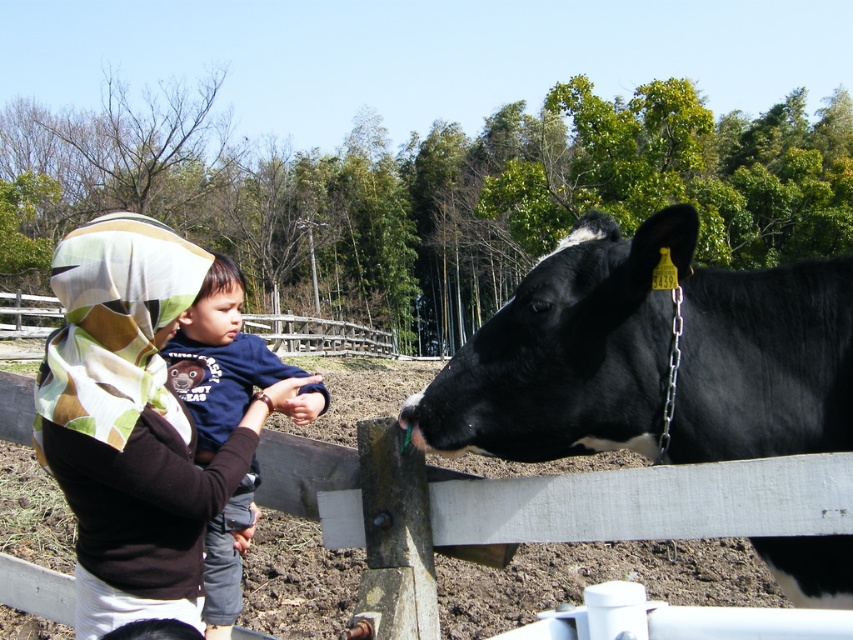
You are a photographer trying to capture a wide shot of the scene. The black glossy cow at right and the brown textured scarf at upper left are both in your frame. Which object occupies a larger portion of the image in terms of width?

The black glossy cow at right occupies a larger portion of the image in terms of width because its width surpasses that of the brown textured scarf at upper left.

You are a photographer trying to capture a photo of the scene. You want to ensure both the brown textured scarf at upper left and the dark blue cotton shirt at center are visible in the frame. Based on their positions, which one should you focus on first to ensure they are both in the shot?

The brown textured scarf at upper left is not as tall as the dark blue cotton shirt at center, so you should focus on the dark blue cotton shirt at center first to ensure both are in the frame.